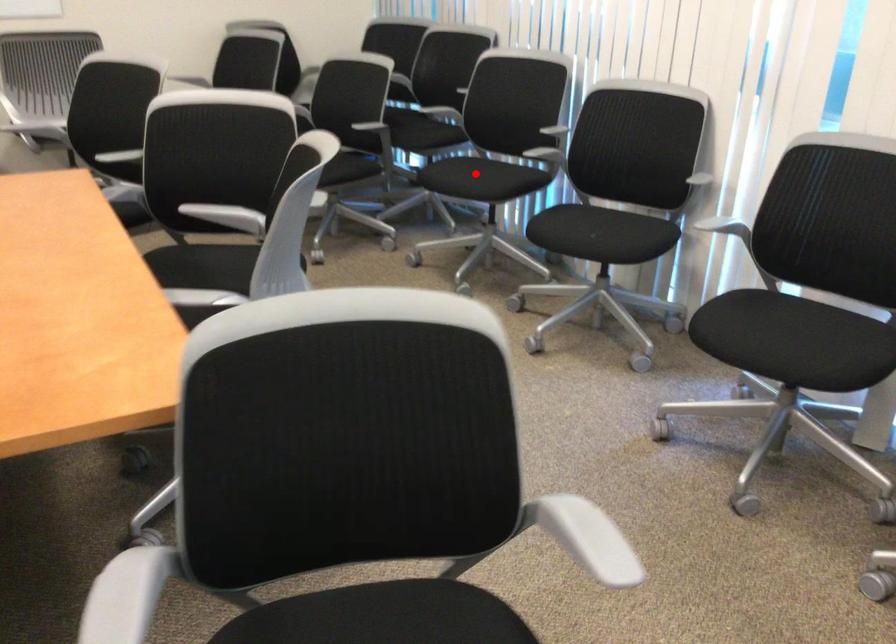
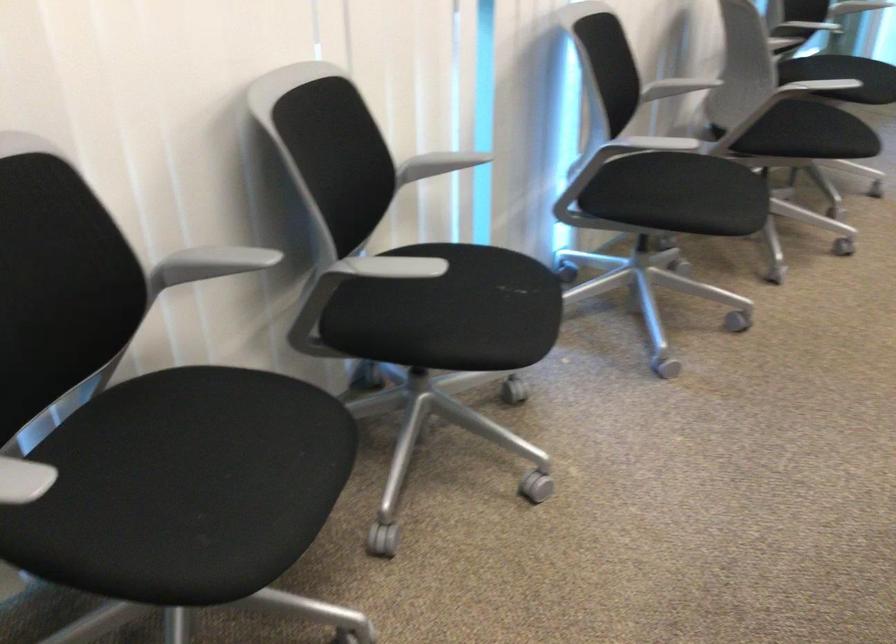
Question: I am providing you with two images of the same scene from different viewpoints. Image1 has a red point marked. In image2, the corresponding 3D location appears at what relative position? Reply with the corresponding letter.

Choices:
 (A) Closer
 (B) Farther

Answer: (A)